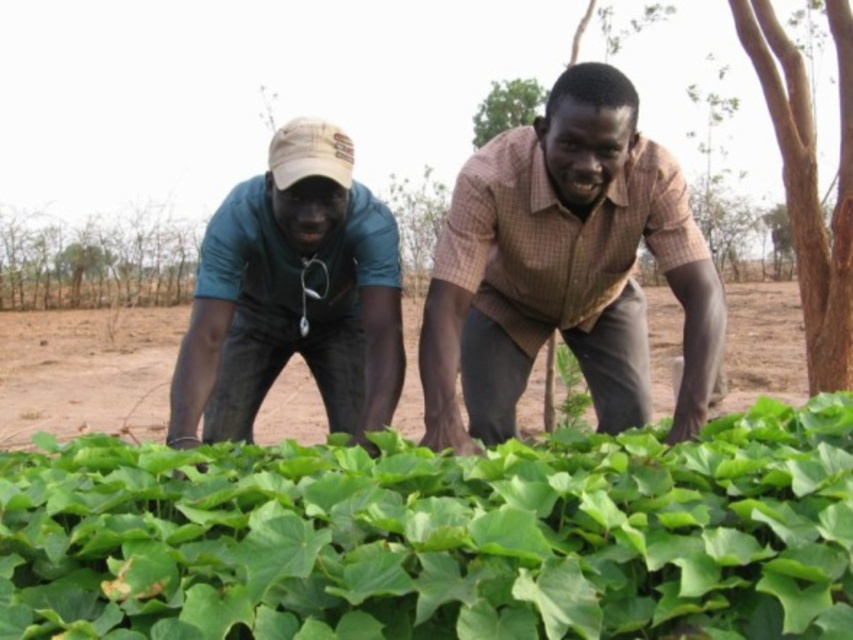
You are standing at the point labeled as point (439, 536) in the image. Looking around, you see two people tending to crops. Which direction should you walk to reach the green leafy plant at lower center?

The point labeled as point (439, 536) corresponds to the green leafy plant at lower center, so you are already at the location of the green leafy plant at lower center.

You are a farmer who needs to decide which shirt to wear for today. You know that the brown checkered shirt at center and the matte green shirt at left are available. Which shirt has a wider body to allow for better airflow and comfort during work?

The brown checkered shirt at center has a larger width than the matte green shirt at left, so it provides better airflow and comfort during work.

You are a farmer who needs to check the health of the green leafy plant at lower center and the matte green shirt at left. Which object is located to the right of the other?

The green leafy plant at lower center is positioned on the right side of matte green shirt at left.